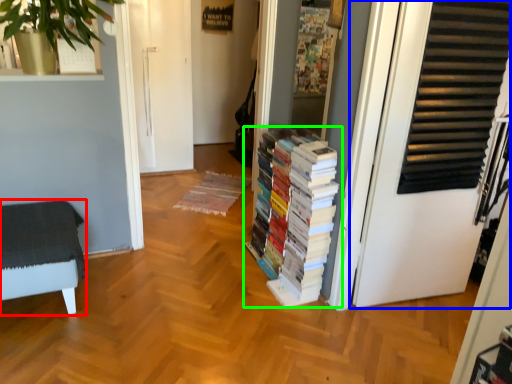
Question: Considering the real-world distances, which object is closest to furniture (highlighted by a red box)? door (highlighted by a blue box) or book (highlighted by a green box).

Choices:
 (A) door
 (B) book

Answer: (B)